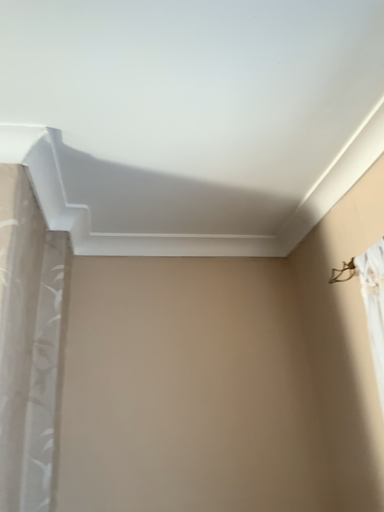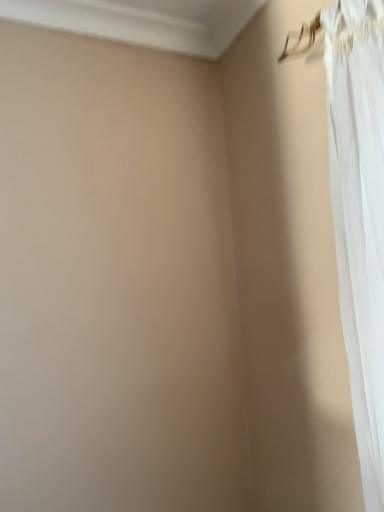
Question: Which way did the camera rotate in the video?

Choices:
 (A) rotated downward
 (B) rotated upward

Answer: (A)